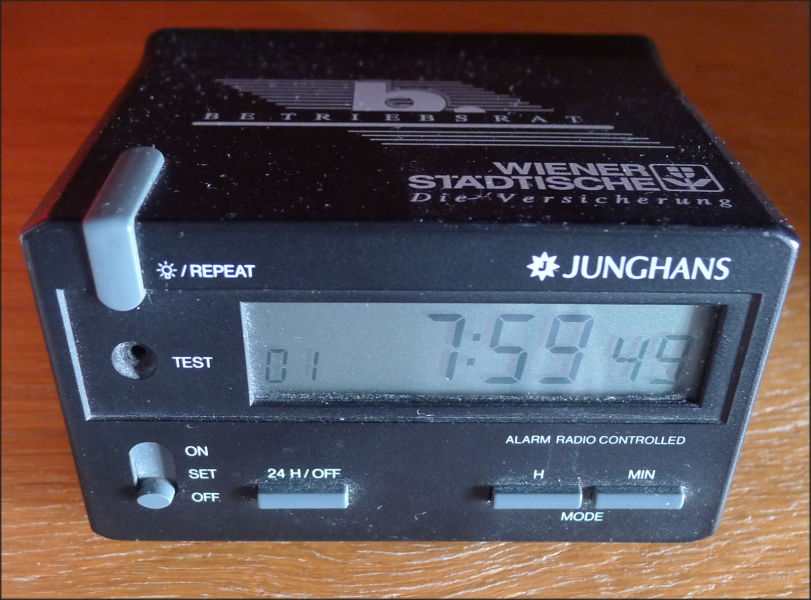
Locate an element on the screen. light/dim switch is located at coordinates (105, 240).